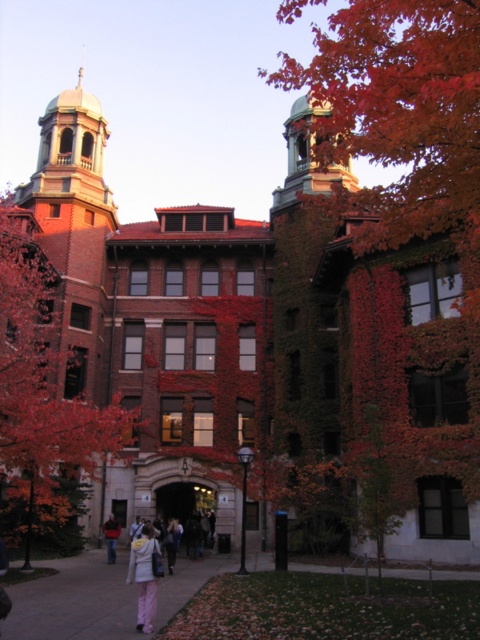
Question: Can you confirm if reddish-brown bark tree at left is bigger than white fleece jacket at lower center?

Choices:
 (A) yes
 (B) no

Answer: (A)

Question: Which point is farther to the camera?

Choices:
 (A) reddish-brown bark tree at left
 (B) paved concrete sidewalk at center

Answer: (A)

Question: Which of the following is the farthest from the observer?

Choices:
 (A) (19, 532)
 (B) (111, 557)
 (C) (61, 582)

Answer: (B)

Question: Is white fleece jacket at lower center below dark gray jacket at center?

Choices:
 (A) no
 (B) yes

Answer: (A)

Question: Which object is the farthest from the white fleece jacket at lower center?

Choices:
 (A) reddish-brown bark tree at left
 (B) dark gray jacket at center
 (C) paved concrete sidewalk at center

Answer: (B)

Question: Is paved concrete sidewalk at center thinner than dark gray jacket at center?

Choices:
 (A) no
 (B) yes

Answer: (A)